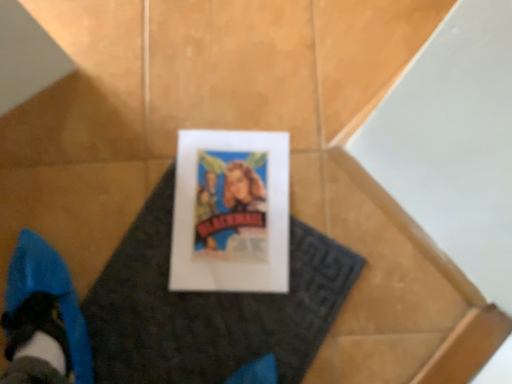
I want to click on vacant area on top of white paper at center (from a real-world perspective), so click(205, 291).